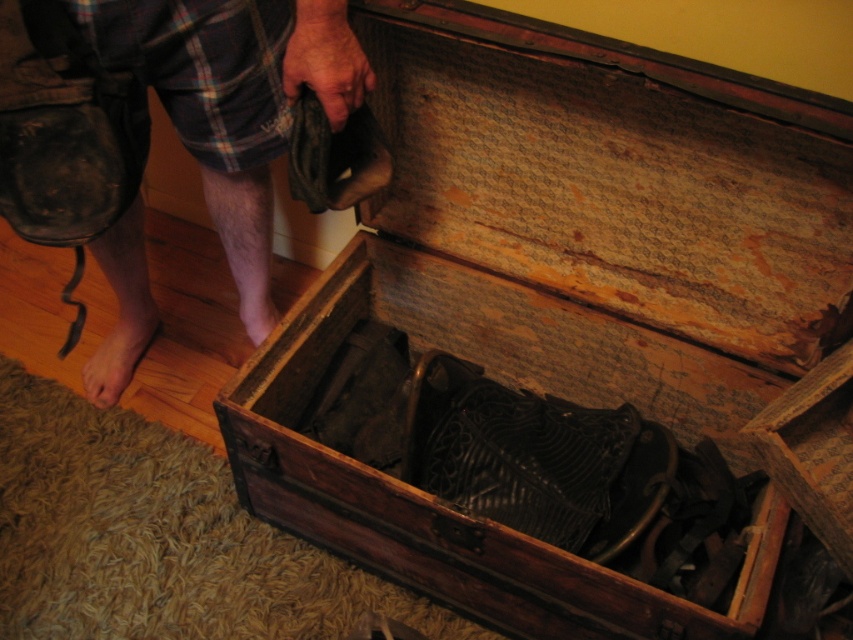
Question: Is wooden trunk at center closer to camera compared to bare skin at lower left?

Choices:
 (A) no
 (B) yes

Answer: (B)

Question: Which is nearer to the wooden trunk at center?

Choices:
 (A) pink flesh at lower left
 (B) bare skin at lower left

Answer: (A)

Question: Which point appears farthest from the camera in this image?

Choices:
 (A) (103, 369)
 (B) (532, 385)

Answer: (A)

Question: Which is farther from the bare skin at lower left?

Choices:
 (A) wooden trunk at center
 (B) pink flesh at lower left

Answer: (A)

Question: In this image, where is wooden trunk at center located relative to pink flesh at lower left?

Choices:
 (A) below
 (B) above

Answer: (A)

Question: Can you confirm if wooden trunk at center is positioned below bare skin at lower left?

Choices:
 (A) no
 (B) yes

Answer: (A)